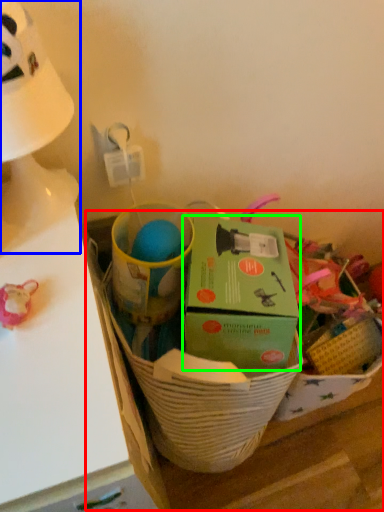
Question: Considering the real-world distances, which object is farthest from cardboard box (highlighted by a red box)? table lamp (highlighted by a blue box) or box (highlighted by a green box)?

Choices:
 (A) table lamp
 (B) box

Answer: (A)